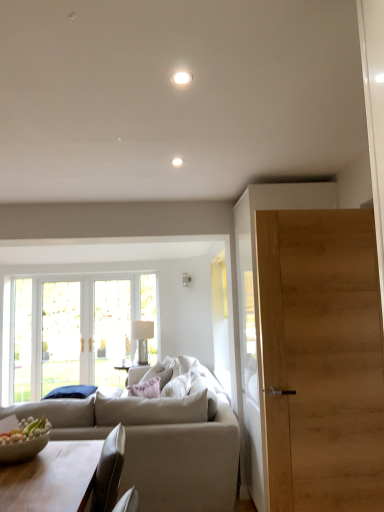
Question: Considering the positions of white fabric pillow at center and silver metallic lamp at center in the image, is white fabric pillow at center wider or thinner than silver metallic lamp at center?

Choices:
 (A) wide
 (B) thin

Answer: (B)

Question: Is white fabric pillow at center to the left or to the right of silver metallic lamp at center in the image?

Choices:
 (A) right
 (B) left

Answer: (A)

Question: Which of these objects is positioned farthest from the light wood door at right?

Choices:
 (A) white glossy ceiling light at upper center
 (B) silver metallic lamp at center
 (C) white fabric pillow at center
 (D) beige fabric couch at center
 (E) light brown wooden coffee table at lower left

Answer: (B)

Question: Based on their relative distances, which object is nearer to the silver metallic lamp at center?

Choices:
 (A) white glossy ceiling light at upper center
 (B) white fabric pillow at center
 (C) light brown wooden coffee table at lower left
 (D) beige fabric couch at center
 (E) light wood door at right

Answer: (B)